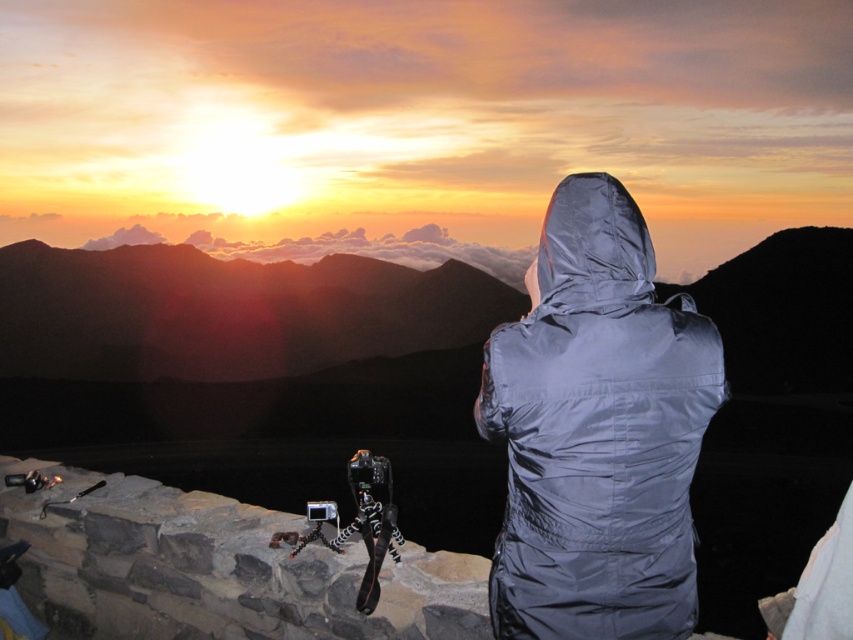
Question: Does gray synthetic jacket at center have a smaller size compared to glossy silver hood at center?

Choices:
 (A) no
 (B) yes

Answer: (A)

Question: Can you confirm if gray synthetic jacket at center is thinner than glossy silver hood at center?

Choices:
 (A) no
 (B) yes

Answer: (A)

Question: Does gray synthetic jacket at center appear under glossy silver hood at center?

Choices:
 (A) no
 (B) yes

Answer: (B)

Question: Which object appears closest to the camera in this image?

Choices:
 (A) gray synthetic jacket at center
 (B) glossy silver hood at center

Answer: (A)